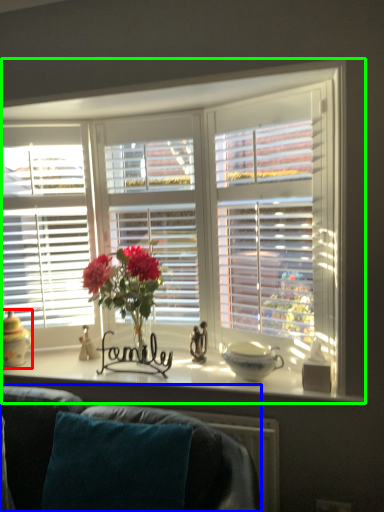
Question: Considering the real-world distances, which object is farthest from candle holder (highlighted by a red box)? studio couch (highlighted by a blue box) or window (highlighted by a green box)?

Choices:
 (A) studio couch
 (B) window

Answer: (B)